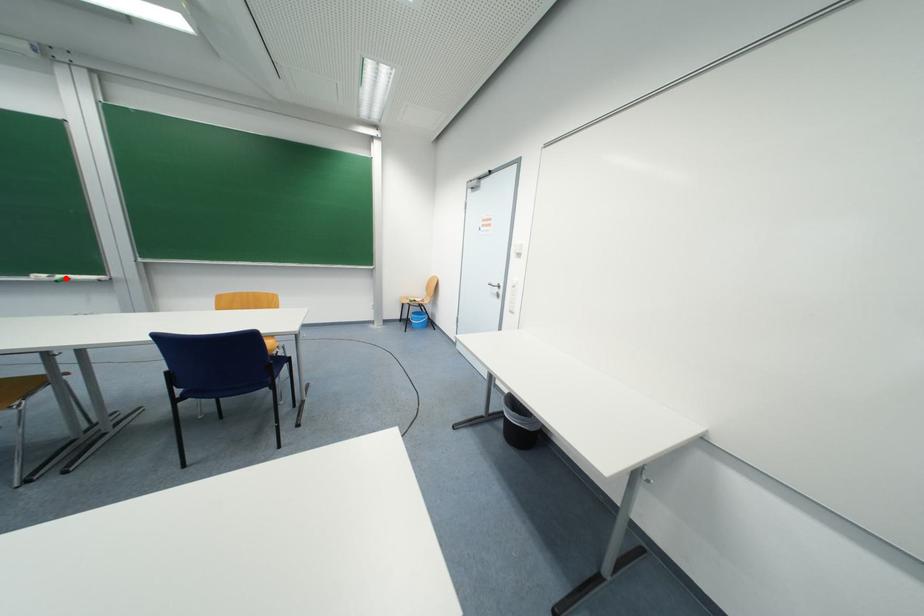
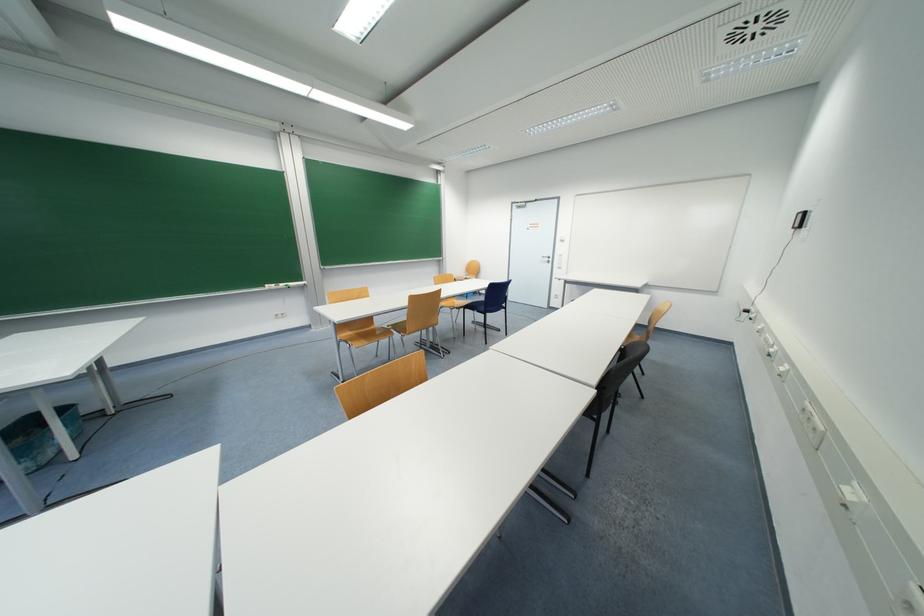
Question: I am providing you with two images of the same scene from different viewpoints. Image1 has a red point marked. In image2, the corresponding 3D location appears at what relative position? Reply with the corresponding letter.

Choices:
 (A) Closer
 (B) Farther

Answer: (A)